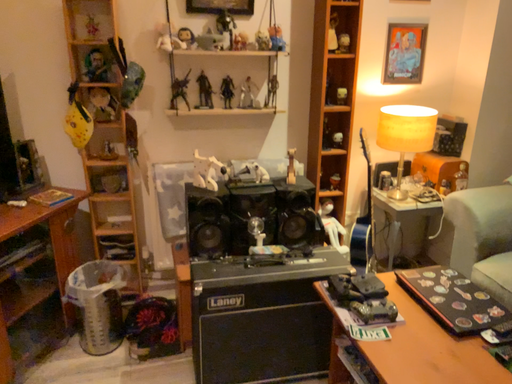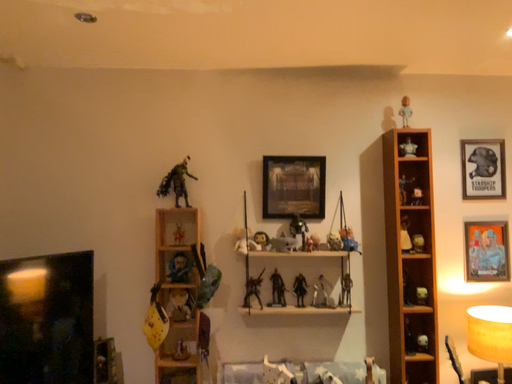
Question: Which way did the camera rotate in the video?

Choices:
 (A) rotated left
 (B) rotated right

Answer: (A)